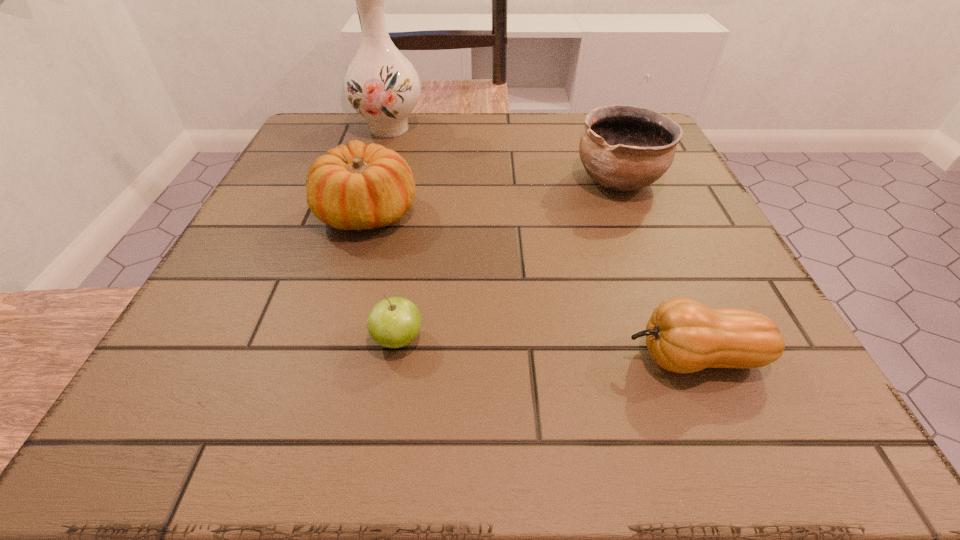
Locate an element on the screen. free space located 0.160m on the front of the farther gourd is located at coordinates (338, 315).

Where is `blank space located 0.210m on the stem side of the fourth tallest object`? The width and height of the screenshot is (960, 540). blank space located 0.210m on the stem side of the fourth tallest object is located at coordinates (470, 357).

Locate an element on the screen. The width and height of the screenshot is (960, 540). free space located 0.380m on the stem side of the fourth tallest object is located at coordinates (347, 357).

You are a GUI agent. You are given a task and a screenshot of the screen. Output one action in this format:
    pyautogui.click(x=<x>, y=<y>)
    Task: Click on the vacant area located 0.350m on the stem side of the fourth tallest object
    The image size is (960, 540).
    Given the screenshot: What is the action you would take?
    pyautogui.click(x=369, y=357)

Locate an element on the screen. free space located on the front of the shortest object is located at coordinates (383, 431).

The height and width of the screenshot is (540, 960). I want to click on vase that is at the far edge, so click(381, 84).

At what (x,y) coordinates should I click in order to perform the action: click on pottery situated at the far edge. Please return your answer as a coordinate pair (x, y). Image resolution: width=960 pixels, height=540 pixels. Looking at the image, I should click on 623,148.

This screenshot has height=540, width=960. What are the coordinates of `object present at the near edge` in the screenshot? It's located at (682, 335).

The width and height of the screenshot is (960, 540). I want to click on vase positioned at the left edge, so click(381, 84).

Find the location of a particular element. gourd at the left edge is located at coordinates (359, 187).